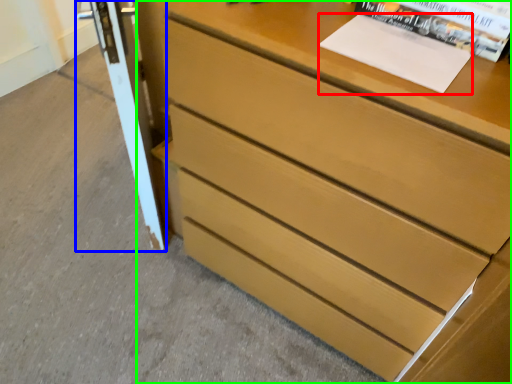
Question: Which is farther away from paperback book (highlighted by a red box)? screen door (highlighted by a blue box) or chest of drawers (highlighted by a green box)?

Choices:
 (A) screen door
 (B) chest of drawers

Answer: (A)